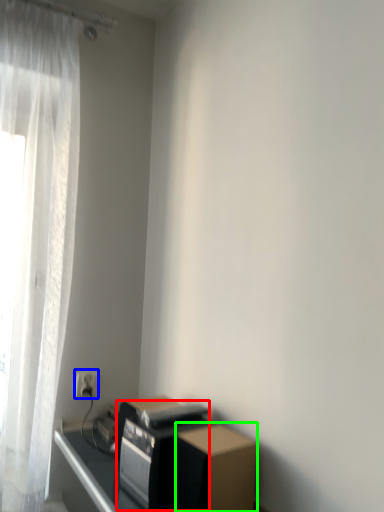
Question: Which object is the closest to the appliance (highlighted by a red box)? Choose among these: electric outlet (highlighted by a blue box) or cardboard box (highlighted by a green box).

Choices:
 (A) electric outlet
 (B) cardboard box

Answer: (B)